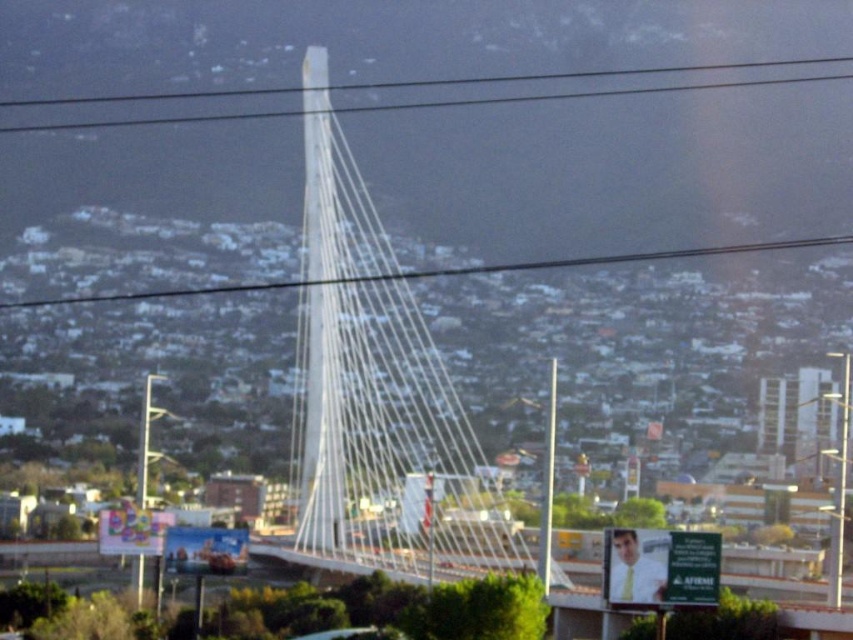
Question: Based on their relative distances, which object is nearer to the white glossy cable at upper center?

Choices:
 (A) white cable-stayed bridge at center
 (B) white wire at center

Answer: (B)

Question: Is white wire at center wider than white glossy cable at upper center?

Choices:
 (A) yes
 (B) no

Answer: (B)

Question: Which object appears farthest from the camera in this image?

Choices:
 (A) white cable-stayed bridge at center
 (B) white wire at center
 (C) white glossy cable at upper center

Answer: (C)

Question: Is white wire at center in front of white glossy cable at upper center?

Choices:
 (A) yes
 (B) no

Answer: (A)

Question: In this image, where is white cable-stayed bridge at center located relative to white glossy cable at upper center?

Choices:
 (A) left
 (B) right

Answer: (A)

Question: Estimate the real-world distances between objects in this image. Which object is farther from the white cable-stayed bridge at center?

Choices:
 (A) white glossy cable at upper center
 (B) white wire at center

Answer: (A)